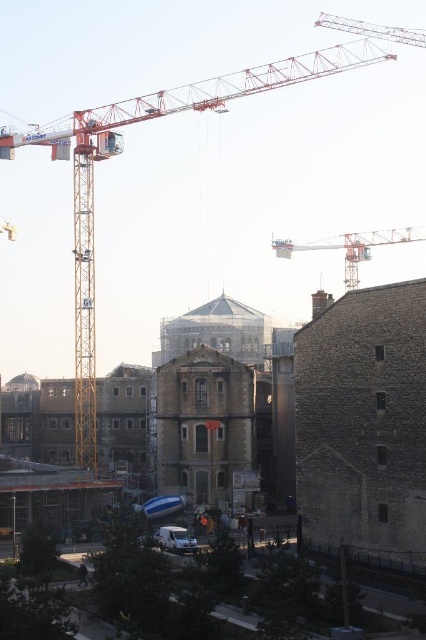
Question: Which point appears farthest from the camera in this image?

Choices:
 (A) (342, 44)
 (B) (249, 444)
 (C) (402, 234)

Answer: (A)

Question: Is brown stone tower at center positioned in front of orange metallic crane at upper center?

Choices:
 (A) no
 (B) yes

Answer: (B)

Question: Does orange metallic crane at upper left appear on the left side of brown stone tower at center?

Choices:
 (A) no
 (B) yes

Answer: (B)

Question: Can you confirm if brown stone tower at center is bigger than orange metallic crane at upper center?

Choices:
 (A) no
 (B) yes

Answer: (A)

Question: Among these points, which one is farthest from the camera?

Choices:
 (A) (83, 163)
 (B) (250, 433)

Answer: (A)

Question: Based on their relative distances, which object is nearer to the orange metallic crane at upper left?

Choices:
 (A) brown stone tower at center
 (B) orange metallic crane at upper center

Answer: (A)